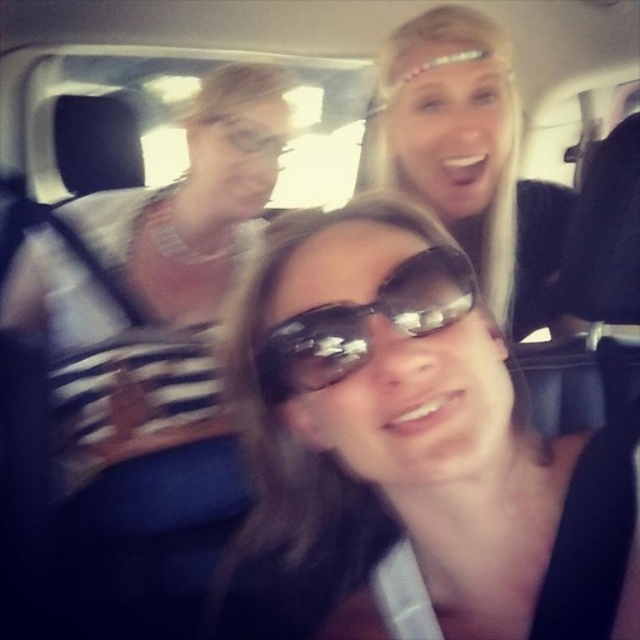
Question: Does sunglasses at center have a larger size compared to black reflective sunglasses at center?

Choices:
 (A) no
 (B) yes

Answer: (B)

Question: Among these objects, which one is nearest to the camera?

Choices:
 (A) matte black dress at upper left
 (B) sunglasses at center
 (C) black reflective sunglasses at center
 (D) blonde hair at upper center

Answer: (B)

Question: Which object is positioned closest to the matte black dress at upper left?

Choices:
 (A) blonde hair at upper center
 (B) sunglasses at center
 (C) black reflective sunglasses at center

Answer: (B)

Question: Estimate the real-world distances between objects in this image. Which object is farther from the matte black dress at upper left?

Choices:
 (A) black reflective sunglasses at center
 (B) blonde hair at upper center

Answer: (A)

Question: Is matte black dress at upper left below blonde hair at upper center?

Choices:
 (A) yes
 (B) no

Answer: (A)

Question: Is sunglasses at center thinner than black reflective sunglasses at center?

Choices:
 (A) no
 (B) yes

Answer: (A)